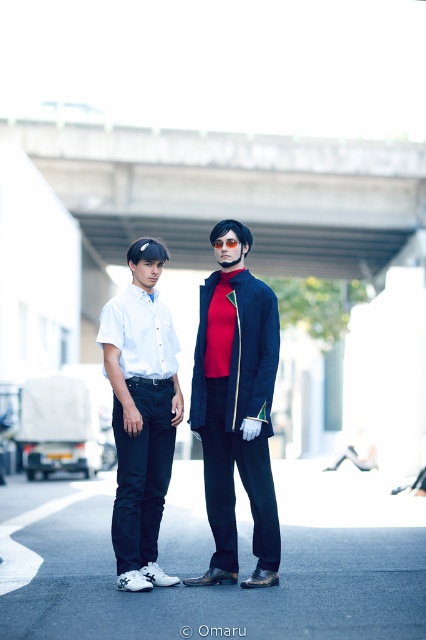
Question: Which of the following is the closest to the observer?

Choices:
 (A) matte black jacket at center
 (B) white glossy shirt at center

Answer: (B)

Question: Can you confirm if matte black jacket at center is thinner than white glossy shirt at center?

Choices:
 (A) no
 (B) yes

Answer: (A)

Question: Is matte black jacket at center bigger than white glossy shirt at center?

Choices:
 (A) yes
 (B) no

Answer: (A)

Question: Is the position of matte black jacket at center less distant than that of white glossy shirt at center?

Choices:
 (A) yes
 (B) no

Answer: (B)